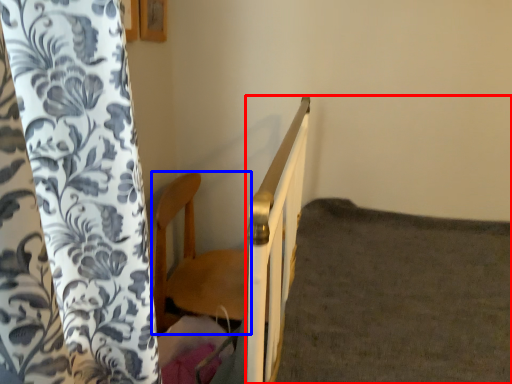
Question: Which object appears farthest to the camera in this image, bed frame (highlighted by a red box) or furniture (highlighted by a blue box)?

Choices:
 (A) bed frame
 (B) furniture

Answer: (B)